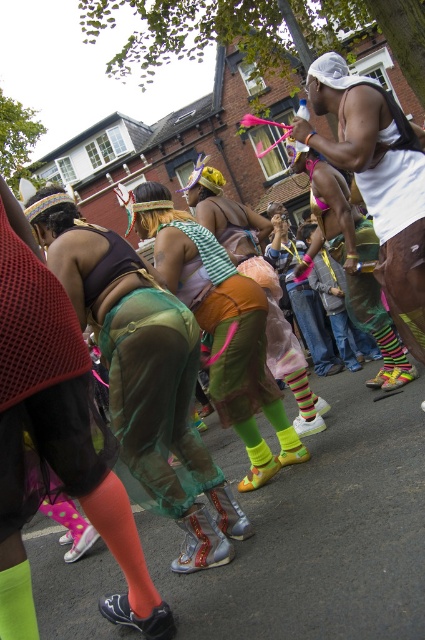
Consider the image. You are a photographer trying to capture the vibrant costumes in the scene. You notice the green mesh dress at center and the white matte tank top at upper right. Which of these two items is positioned farther away from the camera?

The white matte tank top at upper right is behind the green mesh dress at center, so it is farther away from the camera.

You are a photographer trying to capture the vibrant costumes of the participants in the street scene. You notice the green mesh skirt at center and the white matte tank top at upper right. Which clothing item should you aim your camera at first if you want to photograph them in order from left to right?

The green mesh skirt at center is to the left of the white matte tank top at upper right, so you should aim your camera at the green mesh skirt at center first before moving to the white matte tank top at upper right.

Looking at this image, you are a photographer trying to capture the vibrant costumes in the scene. You notice two green mesh garments at the center of the image. Which one is bigger in size between the green mesh skirt at center and the green mesh dress at center?

The green mesh skirt at center has a larger size compared to the green mesh dress at center, so the skirt is bigger.